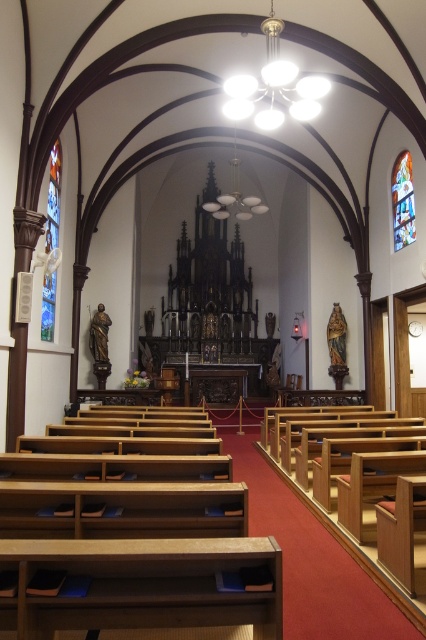
You are standing at the entrance of the church and want to take a photo of the stained glass window at left and the stained glass at upper right. Which one is located lower in the image?

The stained glass window at left is positioned under the stained glass at upper right, so the stained glass window at left is lower in the image.

You are standing at the entrance of the church and want to take a photo of both the stained glass window at left and the stained glass at upper right in the same frame. Based on their distance apart, do you think you can capture both in a single photo without moving your camera?

The stained glass window at left is 22.91 feet away from the stained glass at upper right. Since the distance between them is relatively large, you might need to use a wide angle lens or adjust your position to ensure both are in the frame.